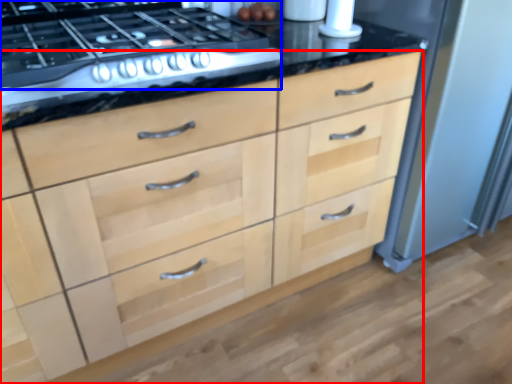
Question: Among these objects, which one is farthest to the camera, chest of drawers (highlighted by a red box) or gas stove (highlighted by a blue box)?

Choices:
 (A) chest of drawers
 (B) gas stove

Answer: (B)